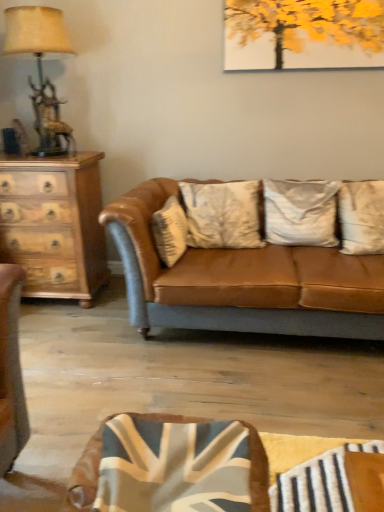
What do you see at coordinates (300, 212) in the screenshot?
I see `white cotton pillow at center, the 2th pillow when ordered from left to right` at bounding box center [300, 212].

Where is `white cotton pillow at center, the 2th pillow when ordered from left to right`? Image resolution: width=384 pixels, height=512 pixels. white cotton pillow at center, the 2th pillow when ordered from left to right is located at coordinates pos(300,212).

Measure the distance from white cotton pillow at center, the second pillow positioned from the right, to white textured pillow at center, which is counted as the 3th pillow, starting from the right.

The distance of white cotton pillow at center, the second pillow positioned from the right, from white textured pillow at center, which is counted as the 3th pillow, starting from the right, is 24.30 inches.

You are a GUI agent. You are given a task and a screenshot of the screen. Output one action in this format:
    pyautogui.click(x=<x>, y=<y>)
    Task: Click on the 1st pillow counting from the right of the white textured pillow at center, the first pillow viewed from the left
    This screenshot has height=512, width=384.
    Given the screenshot: What is the action you would take?
    pyautogui.click(x=300, y=212)

Considering the relative sizes of white cotton pillow at center, the 2th pillow when ordered from left to right, and white textured pillow at center, which is counted as the 3th pillow, starting from the right, in the image provided, is white cotton pillow at center, the 2th pillow when ordered from left to right, smaller than white textured pillow at center, which is counted as the 3th pillow, starting from the right,?

Yes.

Is white cotton pillow at center, the 2th pillow when ordered from left to right, outside of white textured pillow at center, which is counted as the 3th pillow, starting from the right?

white cotton pillow at center, the 2th pillow when ordered from left to right, lies outside white textured pillow at center, which is counted as the 3th pillow, starting from the right,'s area.

Is white textured pillow at center, the first pillow viewed from the left, next to matte gold table lamp at left?

They are not placed beside each other.

Is white textured pillow at center, the first pillow viewed from the left, further to camera compared to matte gold table lamp at left?

No, it is in front of matte gold table lamp at left.

Can you confirm if white textured pillow at center, which is counted as the 3th pillow, starting from the right, is shorter than matte gold table lamp at left?

Yes.

Does white textured pillow at center, the first pillow viewed from the left, have a greater width compared to matte gold table lamp at left?

In fact, white textured pillow at center, the first pillow viewed from the left, might be narrower than matte gold table lamp at left.

Which is correct: wooden chest of drawers at left is inside matte brown leather couch at center, or outside of it?

wooden chest of drawers at left is outside matte brown leather couch at center.

Is wooden chest of drawers at left facing away from matte brown leather couch at center?

No, matte brown leather couch at center is not at the back of wooden chest of drawers at left.

Which of these two, wooden chest of drawers at left or matte brown leather couch at center, stands shorter?

matte brown leather couch at center is shorter.

Does point (47, 193) appear closer or farther from the camera than point (140, 193)?

Point (47, 193).

Is wooden chest of drawers at left closer to camera compared to white cotton pillow at center, the 2th pillow when ordered from left to right?

That is False.

Can we say wooden chest of drawers at left lies outside white cotton pillow at center, the second pillow positioned from the right?

Yes, wooden chest of drawers at left is located beyond the bounds of white cotton pillow at center, the second pillow positioned from the right.

Looking at their sizes, would you say wooden chest of drawers at left is wider or thinner than white cotton pillow at center, the 2th pillow when ordered from left to right?

Considering their sizes, wooden chest of drawers at left looks broader than white cotton pillow at center, the 2th pillow when ordered from left to right.

Is point (79, 220) more distant than point (337, 191)?

Yes, it is.

Would you say matte gold table lamp at left is a long distance from wooden chest of drawers at left?

matte gold table lamp at left is near wooden chest of drawers at left, not far away.

Is matte gold table lamp at left oriented towards wooden chest of drawers at left?

No, matte gold table lamp at left is not facing towards wooden chest of drawers at left.

In the image, is matte gold table lamp at left positioned in front of or behind wooden chest of drawers at left?

matte gold table lamp at left is positioned closer to the viewer than wooden chest of drawers at left.

Considering the points (170, 257) and (291, 218), which point is in front, point (170, 257) or point (291, 218)?

Positioned in front is point (170, 257).

Which pillow is the 2nd one when counting from the back of the white textured pillow at center, the first pillow viewed from the left? Please provide its 2D coordinates.

[(300, 212)]

Based on the photo, can you confirm if white textured pillow at center, which is counted as the 3th pillow, starting from the right, is wider than white cotton pillow at center, the 2th pillow when ordered from left to right?

No, white textured pillow at center, which is counted as the 3th pillow, starting from the right, is not wider than white cotton pillow at center, the 2th pillow when ordered from left to right.

Is white textured pillow at center, the first pillow viewed from the left, not close to white cotton pillow at center, the 2th pillow when ordered from left to right?

No, white textured pillow at center, the first pillow viewed from the left, is not far from white cotton pillow at center, the 2th pillow when ordered from left to right.

How different are the orientations of matte gold table lamp at left and silky white pillow at center, the third pillow positioned from the left, in degrees?

The facing directions of matte gold table lamp at left and silky white pillow at center, the third pillow positioned from the left, are 1.08 degrees apart.

From the image's perspective, which one is positioned higher, matte gold table lamp at left or silky white pillow at center, which ranks as the 1th pillow in right-to-left order?

From the image's view, matte gold table lamp at left is above.

Which is more to the right, matte gold table lamp at left or silky white pillow at center, which ranks as the 1th pillow in right-to-left order?

Positioned to the right is silky white pillow at center, which ranks as the 1th pillow in right-to-left order.

Is point (49, 30) more distant than point (344, 221)?

No, (49, 30) is closer to viewer.

Locate an element on the screen. Image resolution: width=384 pixels, height=512 pixels. pillow located on the left of white cotton pillow at center, the 2th pillow when ordered from left to right is located at coordinates (170, 231).

The height and width of the screenshot is (512, 384). What are the coordinates of `table lamp behind the white textured pillow at center, which is counted as the 3th pillow, starting from the right` in the screenshot? It's located at (41, 69).

Based on their spatial positions, is white cotton pillow at center, the second pillow positioned from the right, or white textured pillow at center, the first pillow viewed from the left, further from matte brown leather couch at center?

white cotton pillow at center, the second pillow positioned from the right, lies further to matte brown leather couch at center than the other object.

Which object lies further to the anchor point white textured pillow at center, which is counted as the 3th pillow, starting from the right, white cotton pillow at center, the second pillow positioned from the right, or matte gold table lamp at left?

matte gold table lamp at left is positioned further to the anchor white textured pillow at center, which is counted as the 3th pillow, starting from the right.

Which object lies nearer to the anchor point matte brown leather couch at center, white textured pillow at center, which is counted as the 3th pillow, starting from the right, or wooden chest of drawers at left?

white textured pillow at center, which is counted as the 3th pillow, starting from the right, is positioned closer to the anchor matte brown leather couch at center.

Estimate the real-world distances between objects in this image. Which object is closer to matte gold table lamp at left, silky white pillow at center, the third pillow positioned from the left, or white textured pillow at center, which is counted as the 3th pillow, starting from the right?

white textured pillow at center, which is counted as the 3th pillow, starting from the right, is closer to matte gold table lamp at left.

Estimate the real-world distances between objects in this image. Which object is further from white cotton pillow at center, the 2th pillow when ordered from left to right, matte gold table lamp at left or white textured pillow at center, the first pillow viewed from the left?

matte gold table lamp at left lies further to white cotton pillow at center, the 2th pillow when ordered from left to right, than the other object.

From the image, which object appears to be nearer to white textured pillow at center, the first pillow viewed from the left, matte brown leather couch at center or wooden chest of drawers at left?

Based on the image, matte brown leather couch at center appears to be nearer to white textured pillow at center, the first pillow viewed from the left.

Estimate the real-world distances between objects in this image. Which object is closer to wooden chest of drawers at left, silky white pillow at center, the third pillow positioned from the left, or white cotton pillow at center, the 2th pillow when ordered from left to right?

white cotton pillow at center, the 2th pillow when ordered from left to right, is positioned closer to the anchor wooden chest of drawers at left.

From the image, which object appears to be nearer to silky white pillow at center, which ranks as the 1th pillow in right-to-left order, white textured pillow at center, which is counted as the 3th pillow, starting from the right, or white cotton pillow at center, the 2th pillow when ordered from left to right?

white cotton pillow at center, the 2th pillow when ordered from left to right, is positioned closer to the anchor silky white pillow at center, which ranks as the 1th pillow in right-to-left order.

Where is `studio couch between matte gold table lamp at left and white cotton pillow at center, the 2th pillow when ordered from left to right`? The height and width of the screenshot is (512, 384). studio couch between matte gold table lamp at left and white cotton pillow at center, the 2th pillow when ordered from left to right is located at coordinates (242, 281).

The height and width of the screenshot is (512, 384). In order to click on chest of drawers between matte gold table lamp at left and white textured pillow at center, which is counted as the 3th pillow, starting from the right, in the up-down direction in this screenshot , I will do `click(55, 224)`.

Find the location of a particular element. The image size is (384, 512). pillow between matte gold table lamp at left and matte brown leather couch at center in the horizontal direction is located at coordinates (170, 231).

You are a GUI agent. You are given a task and a screenshot of the screen. Output one action in this format:
    pyautogui.click(x=<x>, y=<y>)
    Task: Click on the studio couch between wooden chest of drawers at left and white cotton pillow at center, the second pillow positioned from the right
    
    Given the screenshot: What is the action you would take?
    click(x=242, y=281)